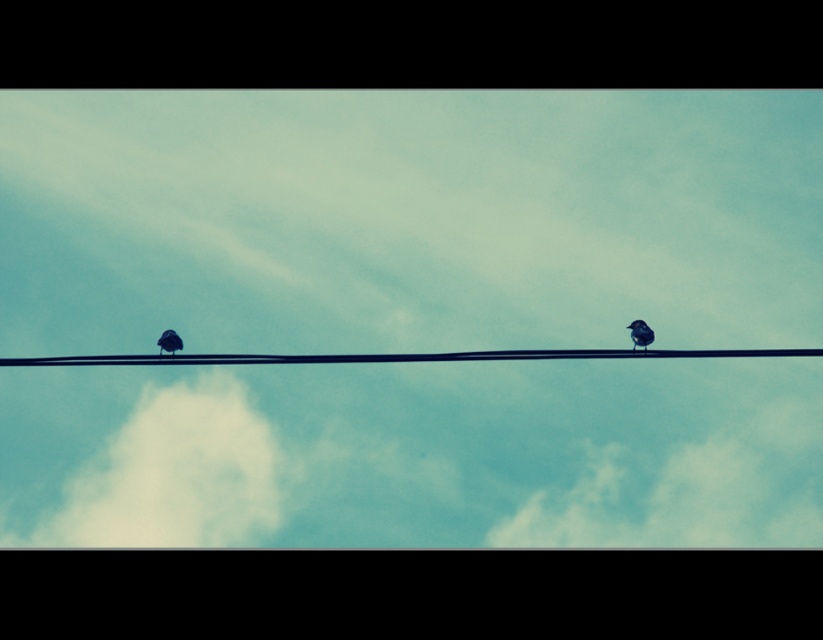
You are an ornithologist observing the scene. You notice the white fluffy cloud at lower left and the black wire at center. Which object is closer to the observer?

The white fluffy cloud at lower left is closer to the observer because the black wire at center is behind it.

You are an astronomer analyzing the image. You notice a point marked at coordinates (689, 492). Based on the scene description, what does this point likely indicate?

The point at coordinates (689, 492) marks the location of a white fluffy cloud at upper center.